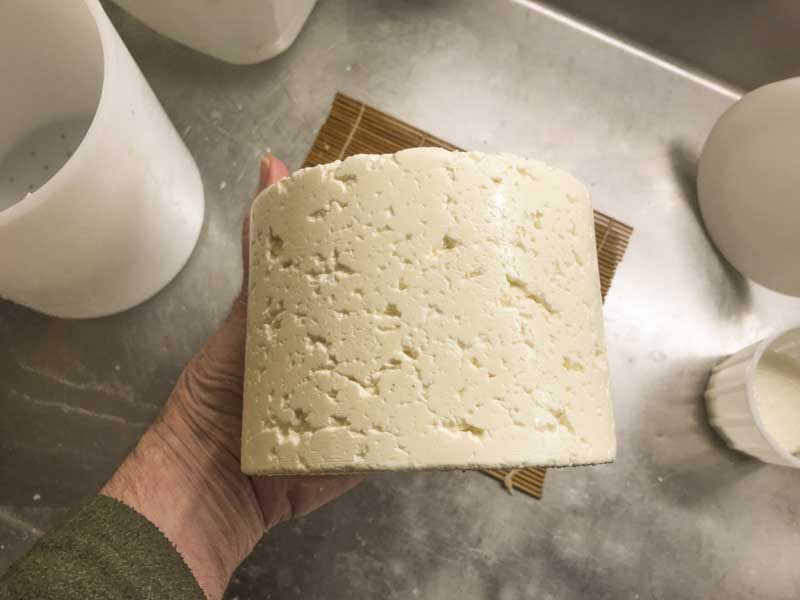
This screenshot has height=600, width=800. I want to click on bamboo mat, so click(x=372, y=137).